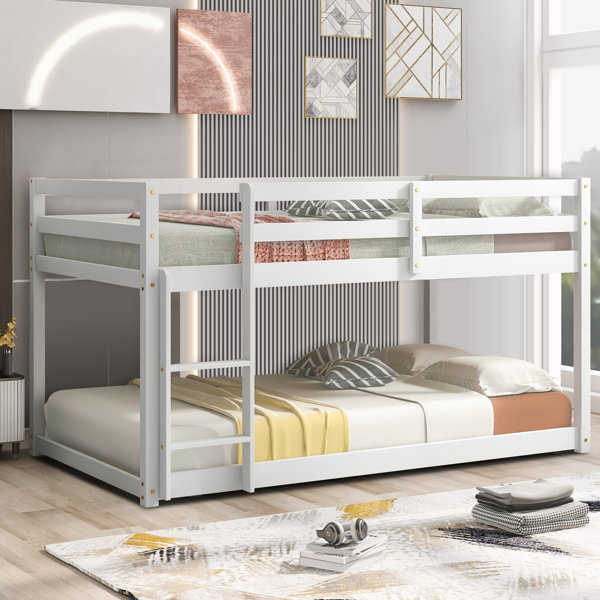
Find the location of a particular element. This screenshot has height=600, width=600. window is located at coordinates (568, 318).